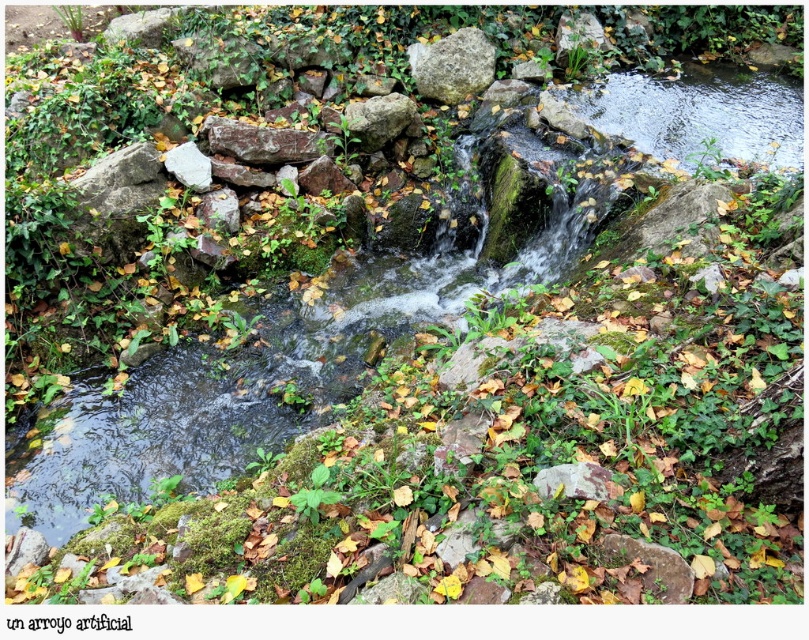
You are a hiker trying to cross the stream shown in the image. You see the speckled gray rock at upper center and the rusty metallic rock at center. Which rock is closer to you as you stand on the bank preparing to step into the water?

The speckled gray rock at upper center is closer to you since the rusty metallic rock at center is positioned behind it.

From the picture: You are standing at the edge of the stream in the image and notice a point marked at coordinates (452, 65). What object is located at that specific point?

The point at (452, 65) is where the speckled gray rock at upper center is located.

You are a hiker who wants to cross the stream by stepping on the rocks. You have a 1.2 meter tall backpack. Can you safely step on the speckled gray rock at upper center and the gray rough rock at center without your backpack touching the water?

The speckled gray rock at upper center is taller than the gray rough rock at center. However, the exact height difference isn not provided. Without knowing if the speckled gray rock is at least 1.2 meters tall, it is impossible to determine if the backpack will stay dry. Please check the rock heights again.